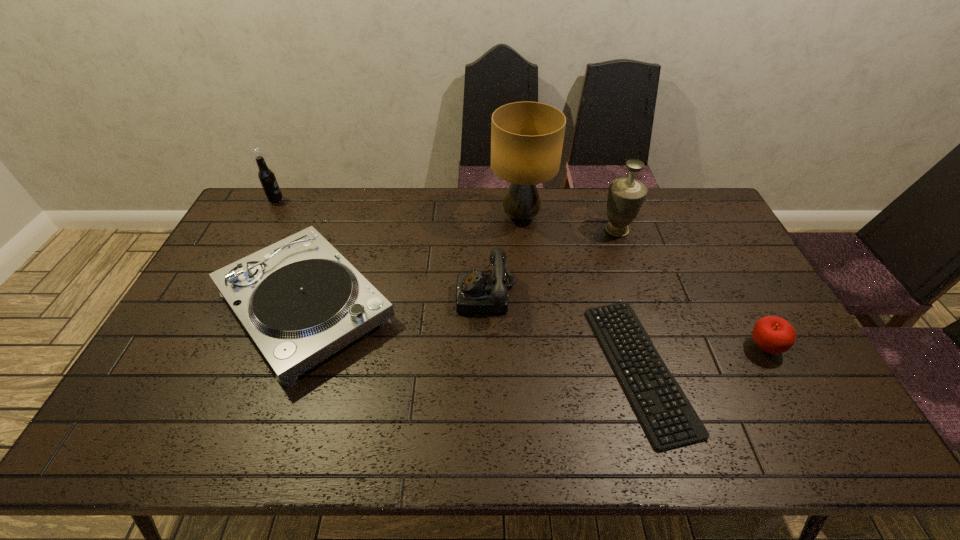
The width and height of the screenshot is (960, 540). In order to click on vacant region that satisfies the following two spatial constraints: 1. on the label of the root beer; 2. on the right side of the shortest object in this screenshot , I will do coord(187,368).

Find the location of a particular element. The image size is (960, 540). blank space that satisfies the following two spatial constraints: 1. on the label of the root beer; 2. on the left side of the rightmost object is located at coordinates (198, 347).

Find the location of `free space that satisfies the following two spatial constraints: 1. on the label of the lampshade; 2. on the right side of the root beer`. free space that satisfies the following two spatial constraints: 1. on the label of the lampshade; 2. on the right side of the root beer is located at coordinates (268, 217).

Find the location of a particular element. The image size is (960, 540). free point that satisfies the following two spatial constraints: 1. on the dial of the fourth tallest object; 2. on the left side of the shortest object is located at coordinates (488, 368).

Where is `free point that satisfies the following two spatial constraints: 1. on the front side of the apple; 2. on the right side of the tallest object`? The image size is (960, 540). free point that satisfies the following two spatial constraints: 1. on the front side of the apple; 2. on the right side of the tallest object is located at coordinates (534, 347).

You are a GUI agent. You are given a task and a screenshot of the screen. Output one action in this format:
    pyautogui.click(x=<x>, y=<y>)
    Task: Click on the free space that satisfies the following two spatial constraints: 1. on the label of the rightmost object; 2. on the left side of the root beer
    This screenshot has width=960, height=540.
    Given the screenshot: What is the action you would take?
    pyautogui.click(x=198, y=347)

Where is `free space that satisfies the following two spatial constraints: 1. on the label of the lampshade; 2. on the left side of the fifth shortest object`? free space that satisfies the following two spatial constraints: 1. on the label of the lampshade; 2. on the left side of the fifth shortest object is located at coordinates (268, 217).